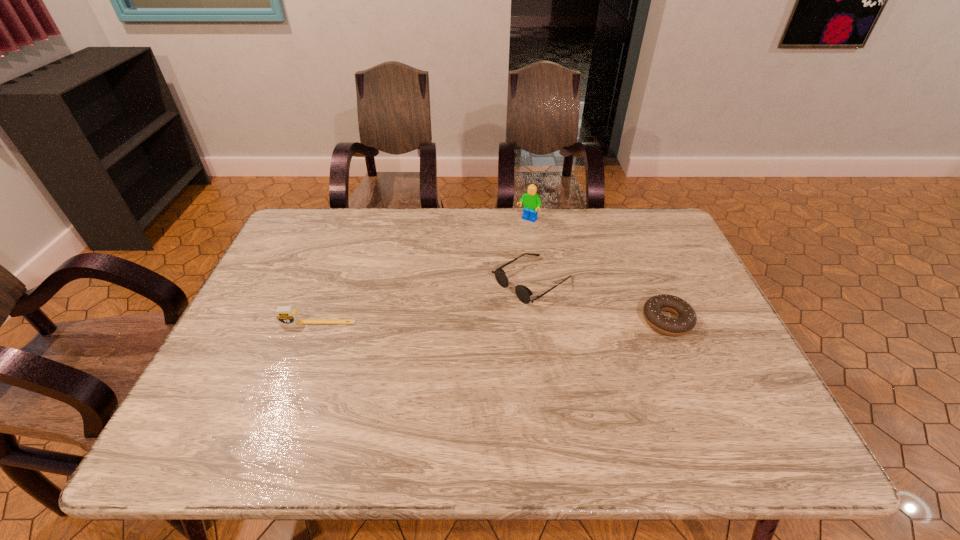
The image size is (960, 540). I want to click on vacant space on the desktop that is between the tape measure and the doughnut and is positioned on the front-facing side of the sunglasses, so click(x=468, y=322).

I want to click on vacant space on the desktop that is between the tape measure and the doughnut and is positioned on the face of the tallest object, so click(444, 322).